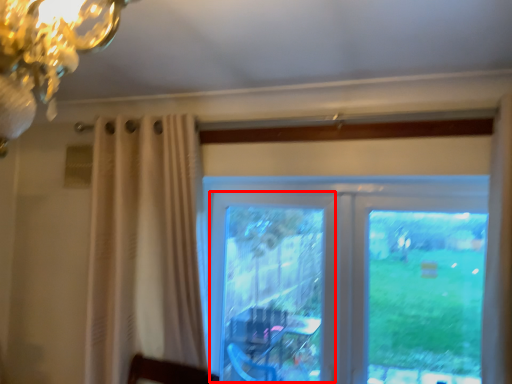
Question: In this image, where is screen door (annotated by the red box) located relative to window?

Choices:
 (A) right
 (B) left

Answer: (B)